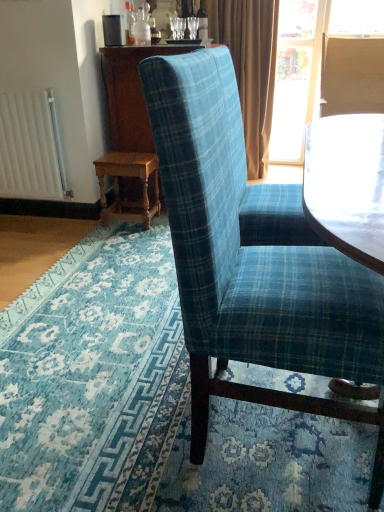
Question: Considering the relative positions of matte brown curtain at upper right and blue plaid fabric chair at center in the image provided, is matte brown curtain at upper right to the left or to the right of blue plaid fabric chair at center?

Choices:
 (A) right
 (B) left

Answer: (A)

Question: Is point [216, 5] closer or farther from the camera than point [210, 61]?

Choices:
 (A) farther
 (B) closer

Answer: (A)

Question: Estimate the real-world distances between objects in this image. Which object is farther from the wooden dresser at center?

Choices:
 (A) blue plaid fabric chair at center
 (B) wooden table at lower left
 (C) wooden chair back at upper right
 (D) matte brown curtain at upper right
 (E) white matte radiator at left

Answer: (A)

Question: Which object is the farthest from the wooden chair back at upper right?

Choices:
 (A) wooden table at lower left
 (B) matte brown curtain at upper right
 (C) blue plaid fabric at center
 (D) wooden dresser at center
 (E) blue plaid fabric chair at center

Answer: (E)